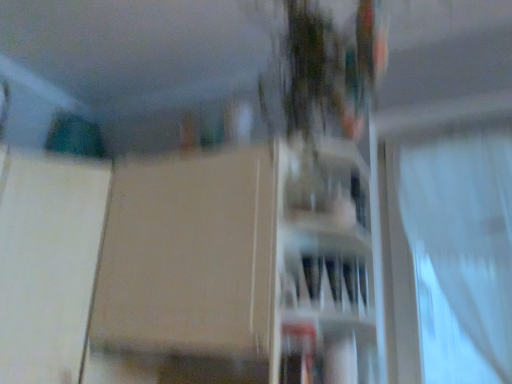
Question: Can you confirm if transparent glass window at upper right is wider than white matte screen door at left?

Choices:
 (A) no
 (B) yes

Answer: (A)

Question: Is transparent glass window at upper right positioned behind white matte screen door at left?

Choices:
 (A) yes
 (B) no

Answer: (A)

Question: Is transparent glass window at upper right to the left of white matte screen door at left from the viewer's perspective?

Choices:
 (A) yes
 (B) no

Answer: (B)

Question: Is transparent glass window at upper right facing away from white matte screen door at left?

Choices:
 (A) no
 (B) yes

Answer: (B)

Question: Is transparent glass window at upper right facing towards white matte screen door at left?

Choices:
 (A) no
 (B) yes

Answer: (A)

Question: From a real-world perspective, is transparent glass window at upper right physically below white matte screen door at left?

Choices:
 (A) no
 (B) yes

Answer: (A)

Question: Is matte white vase at center further to camera compared to transparent glass window at upper right?

Choices:
 (A) no
 (B) yes

Answer: (A)

Question: Is matte white vase at center facing towards transparent glass window at upper right?

Choices:
 (A) no
 (B) yes

Answer: (A)

Question: Is matte white vase at center not near transparent glass window at upper right?

Choices:
 (A) yes
 (B) no

Answer: (B)

Question: Is matte white vase at center closer to camera compared to transparent glass window at upper right?

Choices:
 (A) yes
 (B) no

Answer: (A)

Question: Does matte white vase at center have a larger size compared to transparent glass window at upper right?

Choices:
 (A) yes
 (B) no

Answer: (A)

Question: From a real-world perspective, is matte white vase at center physically above transparent glass window at upper right?

Choices:
 (A) no
 (B) yes

Answer: (A)

Question: Are matte white vase at center and white sheer curtain at right making contact?

Choices:
 (A) no
 (B) yes

Answer: (A)